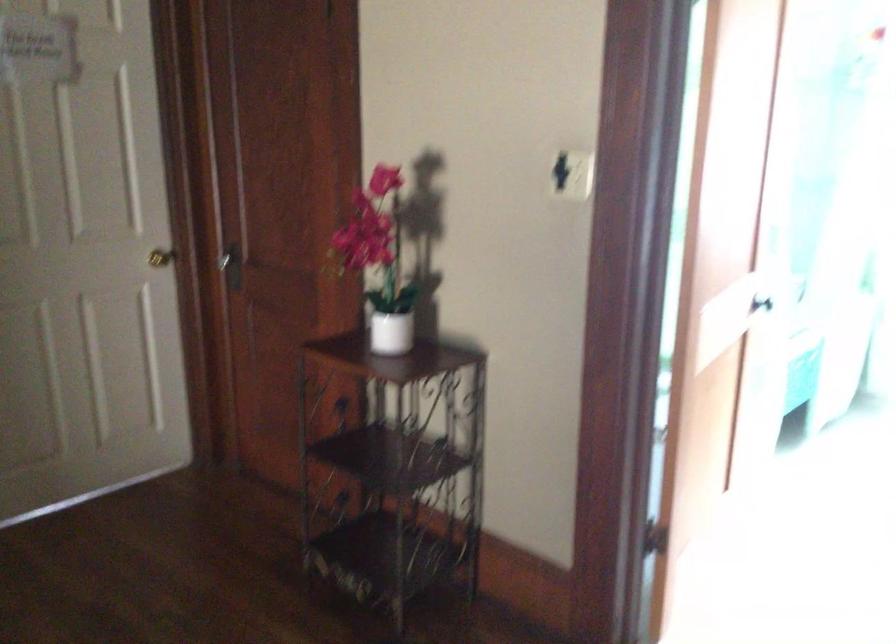
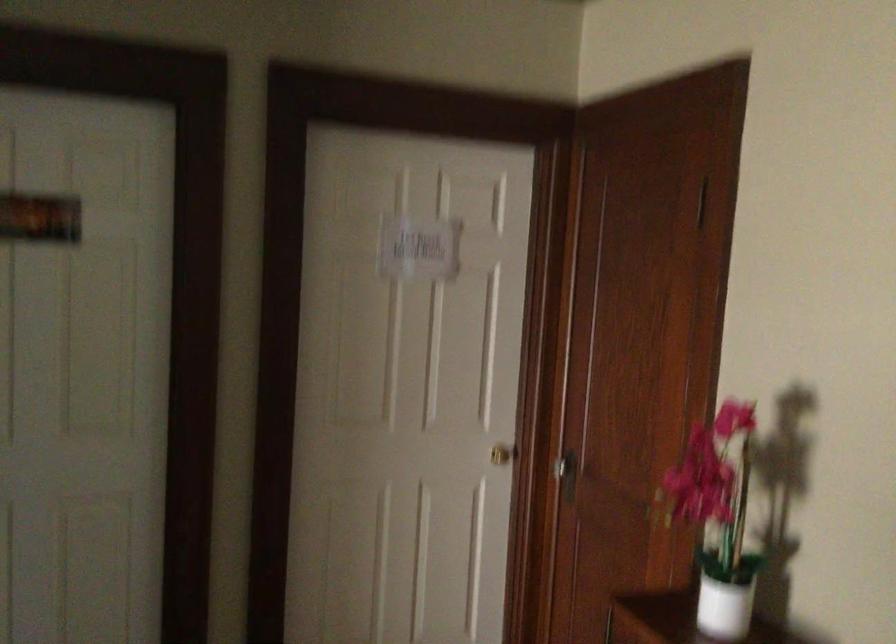
Where in the second image is the point corresponding to point 394,330 from the first image?

(725, 607)